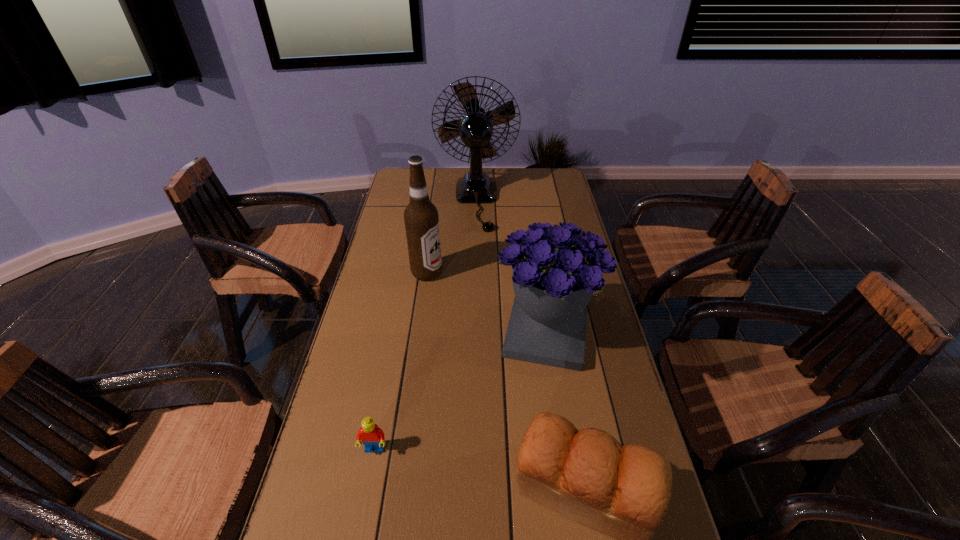
Where is `alcohol that is at the left edge`? The height and width of the screenshot is (540, 960). alcohol that is at the left edge is located at coordinates (421, 219).

Where is `Lego positioned at the left edge`? This screenshot has height=540, width=960. Lego positioned at the left edge is located at coordinates (372, 437).

Locate an element on the screen. The width and height of the screenshot is (960, 540). object located at the right edge is located at coordinates (556, 269).

The image size is (960, 540). I want to click on vacant space at the far edge of the desktop, so click(514, 170).

In order to click on vacant space at the left edge of the desktop in this screenshot , I will do `click(366, 289)`.

Find the location of a particular element. The image size is (960, 540). vacant space at the right edge is located at coordinates (591, 419).

Find the location of a particular element. This screenshot has height=540, width=960. free spot between the bouquet and the alcohol is located at coordinates (486, 304).

At what (x,y) coordinates should I click in order to perform the action: click on free space that is in between the third tallest object and the second farthest object. Please return your answer as a coordinate pair (x, y). Looking at the image, I should click on (486, 304).

Find the location of a particular element. The height and width of the screenshot is (540, 960). free space between the Lego and the second farthest object is located at coordinates (400, 361).

This screenshot has height=540, width=960. I want to click on free space between the alcohol and the shortest object, so click(400, 361).